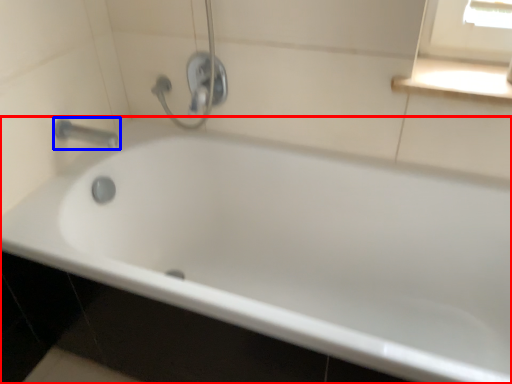
Question: Which of the following is the closest to the observer, bathtub (highlighted by a red box) or tap (highlighted by a blue box)?

Choices:
 (A) bathtub
 (B) tap

Answer: (A)